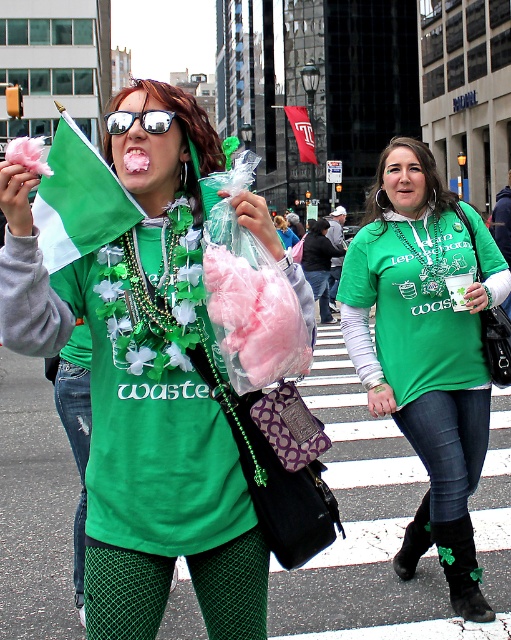
You are a photographer standing at the center of the street. You want to take a photo that includes both the green fabric flag at upper left and the red fabric flag at center. Given that your camera has a maximum zoom range of 50 meters, can you capture both flags in a single frame without moving?

The green fabric flag at upper left and red fabric flag at center are 32.60 meters apart from each other. Since the distance between them is within the camera maximum zoom range of 50 meters, you can capture both flags in a single frame without moving.

You are a photographer trying to capture a closeup of the green matte shirt at center and the red fabric flag at center. Given that your camera can only focus on objects wider than 15 cm, can both items be captured clearly?

The green matte shirt at center has a width less than the red fabric flag at center. Since the camera requires objects wider than 15 cm to focus, we need to know the exact width of each. However, the description only states their relative sizes. Without specific measurements, we cannot confirm if both meet the 15 cm requirement.

You are standing on the street and want to place a small gift at the exact location of the black suede boot at lower right. According to the coordinates provided, where should you place the gift?

The black suede boot at lower right is located at point (413, 541), so you should place the gift at those coordinates.